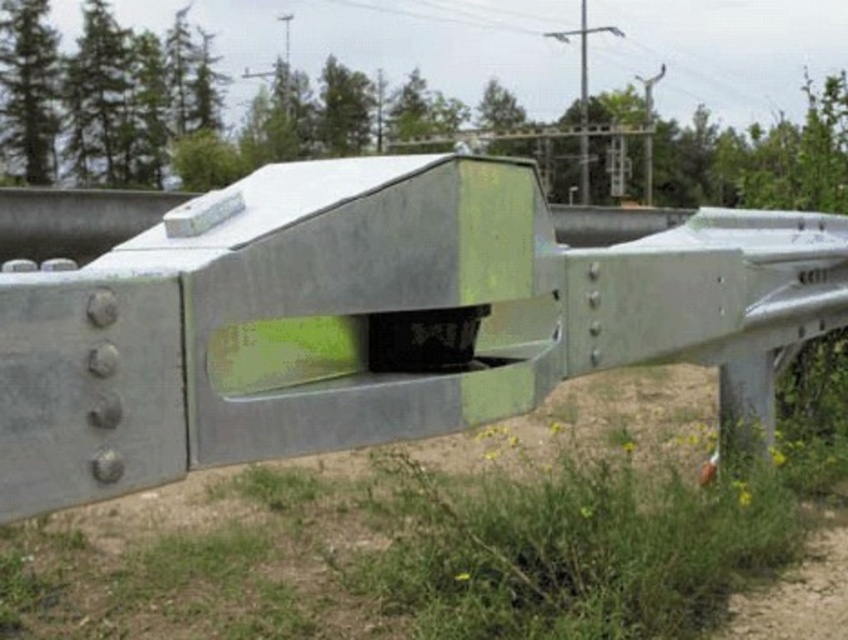
You are a hiker trying to decide between two paths at the base of the guardrail. One path is the dirt track at lower center and the other is the green grass at lower right. Which path is closer to the left side of the guardrail?

The dirt track at lower center is to the left of the green grass at lower right, so the dirt track at lower center is closer to the left side of the guardrail.

You are a drone operator who needs to position a camera exactly at the center of the green matte metal rail at center. According to the coordinates provided, where should you set the camera coordinates?

The camera should be positioned at coordinates point (375,321) to be exactly at the center of the green matte metal rail at center.

You are a hiker who wants to cross the dirt track at lower center. There is a green matte metal rail at center blocking your path. Can you walk around the rail to reach the track?

The green matte metal rail at center is located above the dirt track at lower center, so you can walk around the rail to reach the dirt track at lower center since it is positioned above and not directly blocking the path.